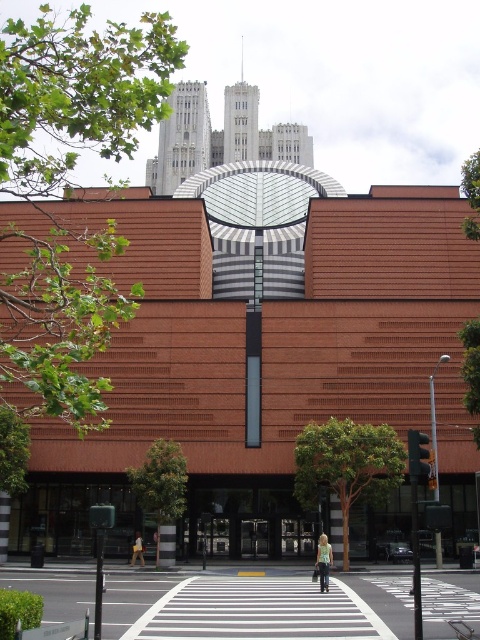
Question: Which object appears farthest from the camera in this image?

Choices:
 (A) denim jacket at center
 (B) light brown leather jacket at center

Answer: (B)

Question: Can you confirm if denim jacket at center is smaller than light brown leather jacket at center?

Choices:
 (A) no
 (B) yes

Answer: (A)

Question: From the image, what is the correct spatial relationship of denim jacket at center in relation to light brown leather jacket at center?

Choices:
 (A) left
 (B) right

Answer: (B)

Question: Is denim jacket at center to the left of light brown leather jacket at center from the viewer's perspective?

Choices:
 (A) no
 (B) yes

Answer: (A)